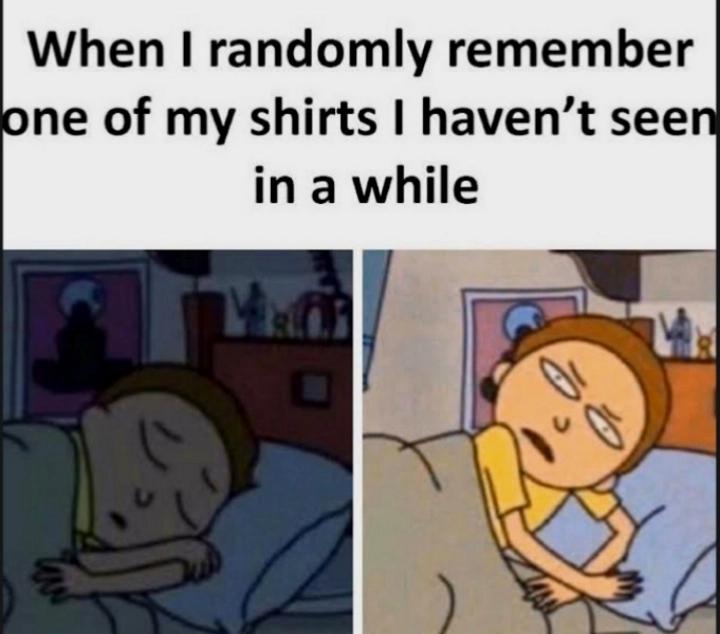
This screenshot has height=634, width=720. Identify the location of blanket. (47, 508), (405, 518).